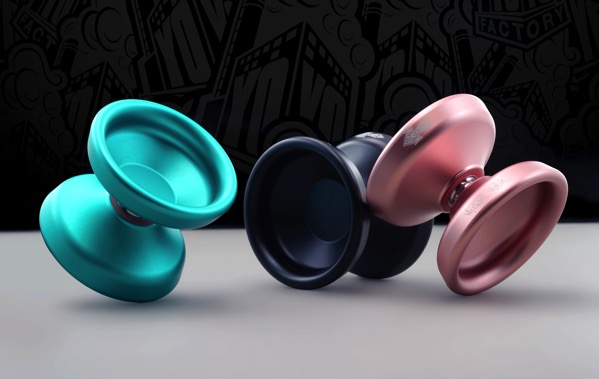
Where is `table`? The height and width of the screenshot is (379, 599). table is located at coordinates (235, 316).